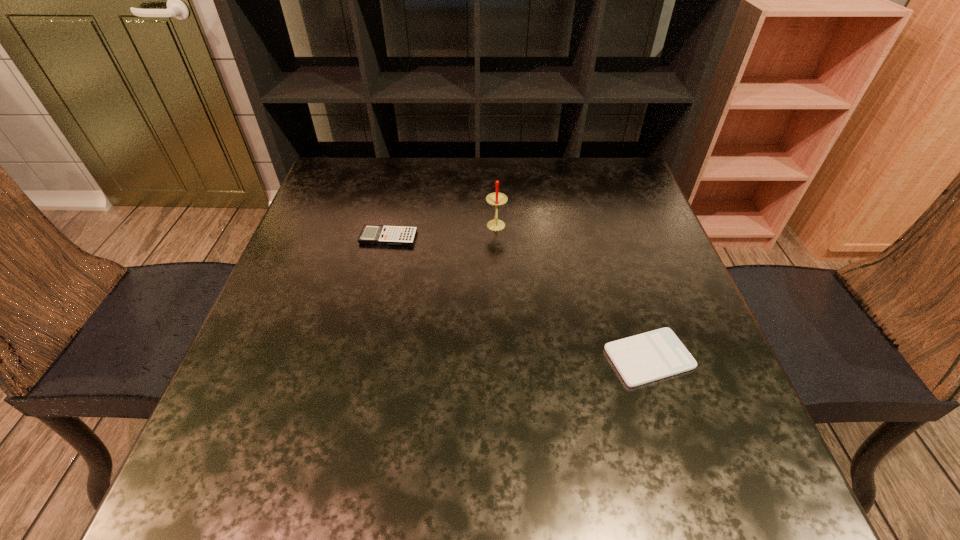
Where is `object at the right edge`? object at the right edge is located at coordinates (643, 358).

Find the location of a particular element. The image size is (960, 540). free space at the far edge of the desktop is located at coordinates (483, 177).

In the image, there is a desktop. At what (x,y) coordinates should I click in order to perform the action: click on free space at the near edge. Please return your answer as a coordinate pair (x, y). Image resolution: width=960 pixels, height=540 pixels. Looking at the image, I should click on (450, 469).

Locate an element on the screen. The height and width of the screenshot is (540, 960). vacant space at the left edge of the desktop is located at coordinates (367, 214).

Identify the location of free region at the right edge of the desktop. (624, 240).

The image size is (960, 540). In the image, there is a desktop. In order to click on vacant space at the near left corner in this screenshot , I will do `click(271, 489)`.

Locate an element on the screen. vacant area at the far right corner of the desktop is located at coordinates (592, 169).

This screenshot has width=960, height=540. In order to click on vacant space at the near right corner in this screenshot , I will do `click(710, 462)`.

The width and height of the screenshot is (960, 540). Find the location of `vacant region between the second object from right to left and the left calculator`. vacant region between the second object from right to left and the left calculator is located at coordinates (443, 232).

At what (x,y) coordinates should I click in order to perform the action: click on blank region between the farther calculator and the rightmost object. Please return your answer as a coordinate pair (x, y). This screenshot has width=960, height=540. Looking at the image, I should click on (518, 298).